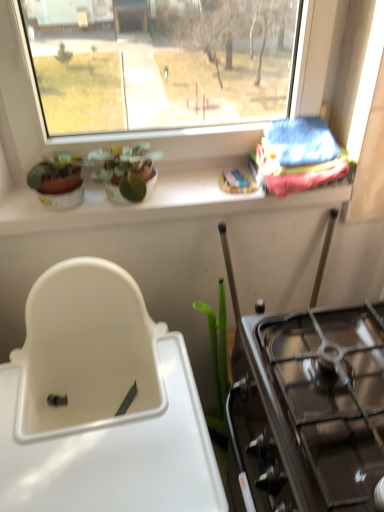
Identify the location of empty space that is in between matte ceramic plant at upper center and blue fabric at upper right. The image size is (384, 512). (195, 184).